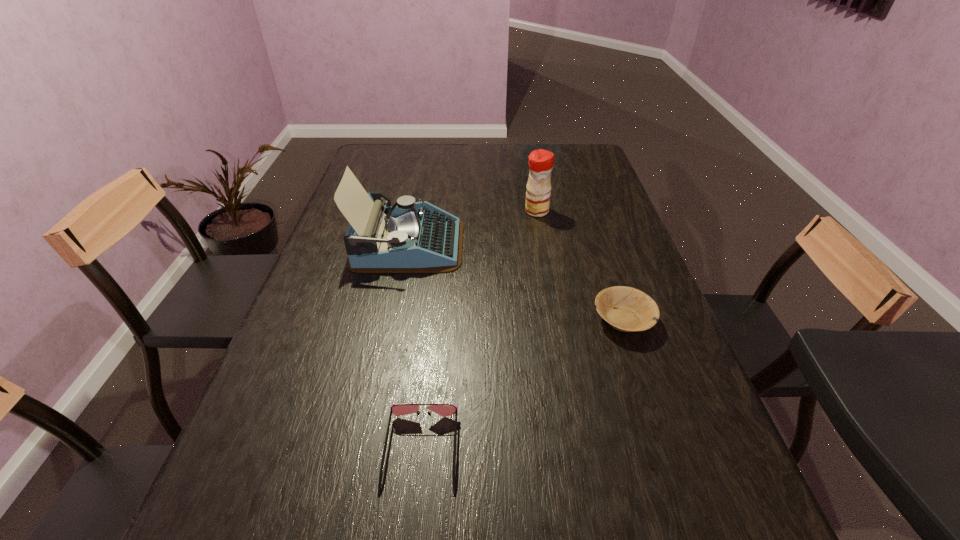
Locate an element on the screen. This screenshot has height=540, width=960. free spot between the third farthest object and the typewriter is located at coordinates (516, 282).

Identify the location of vacant area that lies between the second nearest object and the nearest object. (522, 386).

You are a GUI agent. You are given a task and a screenshot of the screen. Output one action in this format:
    pyautogui.click(x=<x>, y=<y>)
    Task: Click on the unoccupied area between the third nearest object and the farthest object
    
    Given the screenshot: What is the action you would take?
    pyautogui.click(x=472, y=228)

Locate an element on the screen. Image resolution: width=960 pixels, height=540 pixels. empty location between the sunglasses and the second farthest object is located at coordinates (415, 348).

Identify the location of empty location between the condiment and the nearest object. This screenshot has height=540, width=960. point(479,331).

Identify which object is the second nearest to the third object from left to right. Please provide its 2D coordinates. Your answer should be formatted as a tuple, i.e. [(x, y)], where the tuple contains the x and y coordinates of a point satisfying the conditions above.

[(627, 309)]

The height and width of the screenshot is (540, 960). In order to click on object that is the third nearest to the nearest object in this screenshot , I will do `click(541, 162)`.

Image resolution: width=960 pixels, height=540 pixels. What are the coordinates of `free spot that satisfies the following two spatial constraints: 1. on the typing side of the second farthest object; 2. on the back side of the second nearest object` in the screenshot? It's located at (393, 320).

Where is `vacant region that satisfies the following two spatial constraints: 1. on the typing side of the second farthest object; 2. on the back side of the rightmost object`? Image resolution: width=960 pixels, height=540 pixels. vacant region that satisfies the following two spatial constraints: 1. on the typing side of the second farthest object; 2. on the back side of the rightmost object is located at coordinates (393, 320).

Locate an element on the screen. The width and height of the screenshot is (960, 540). free location that satisfies the following two spatial constraints: 1. on the typing side of the second farthest object; 2. on the left side of the second nearest object is located at coordinates (393, 320).